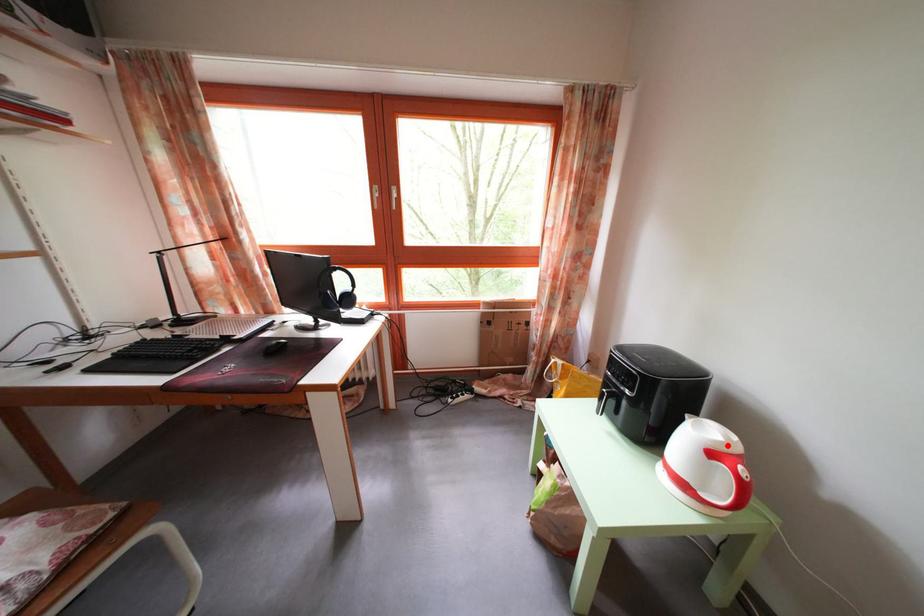
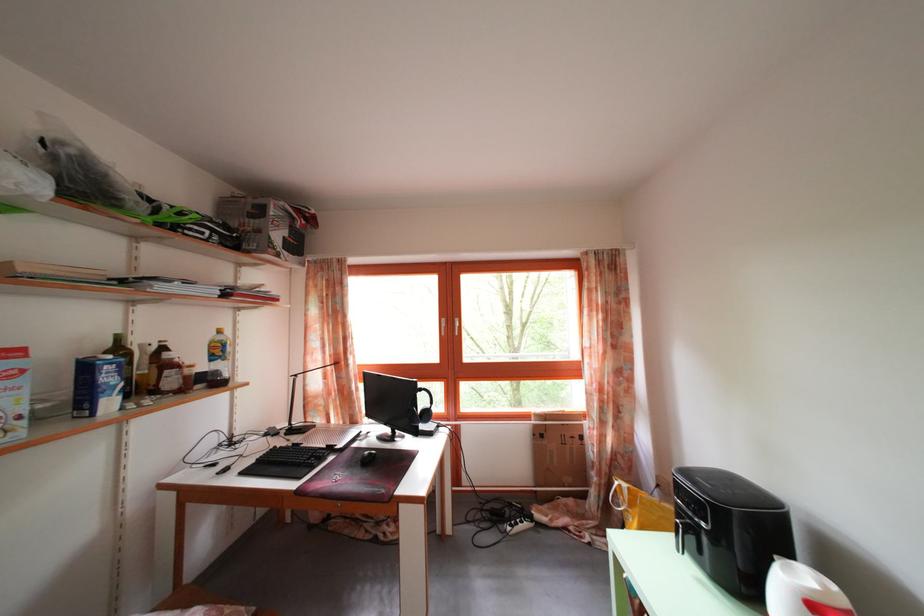
Locate, in the second image, the point that corresponds to the highlighted location in the first image.

(822, 593)